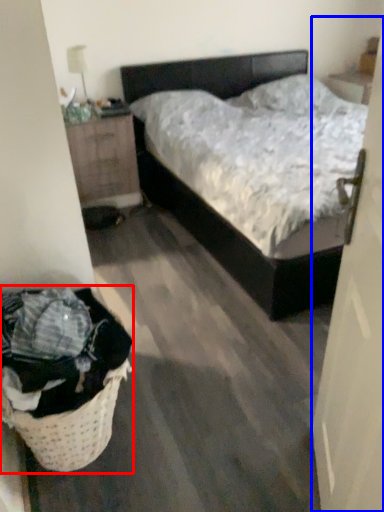
Question: Among these objects, which one is farthest to the camera, laundry basket (highlighted by a red box) or door (highlighted by a blue box)?

Choices:
 (A) laundry basket
 (B) door

Answer: (A)